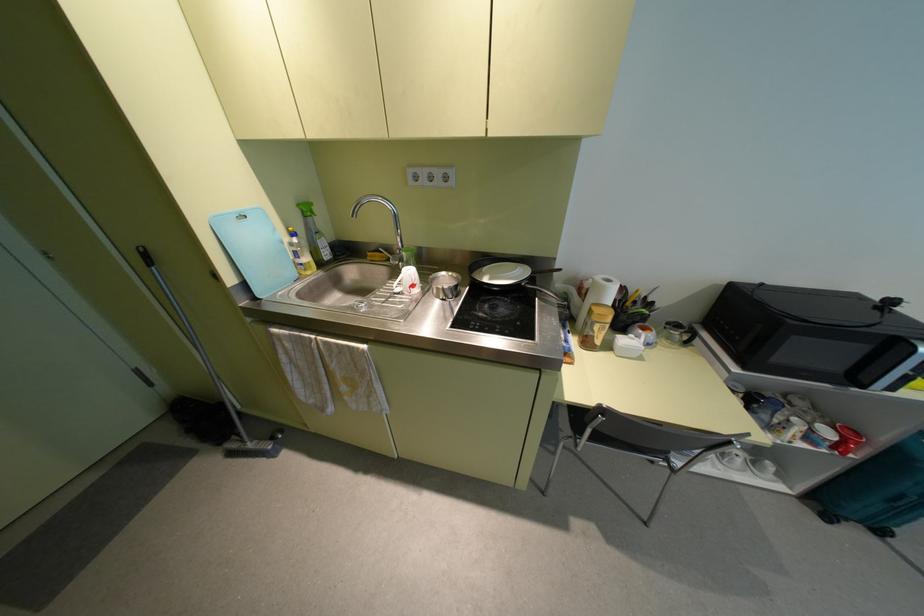
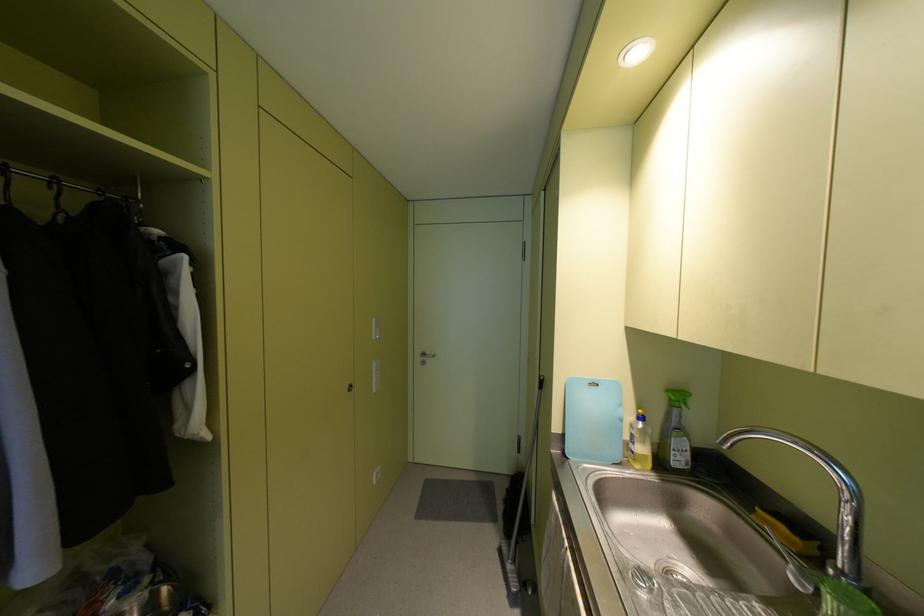
Where in the second image is the point corresponding to (308,214) from the first image?

(675, 403)